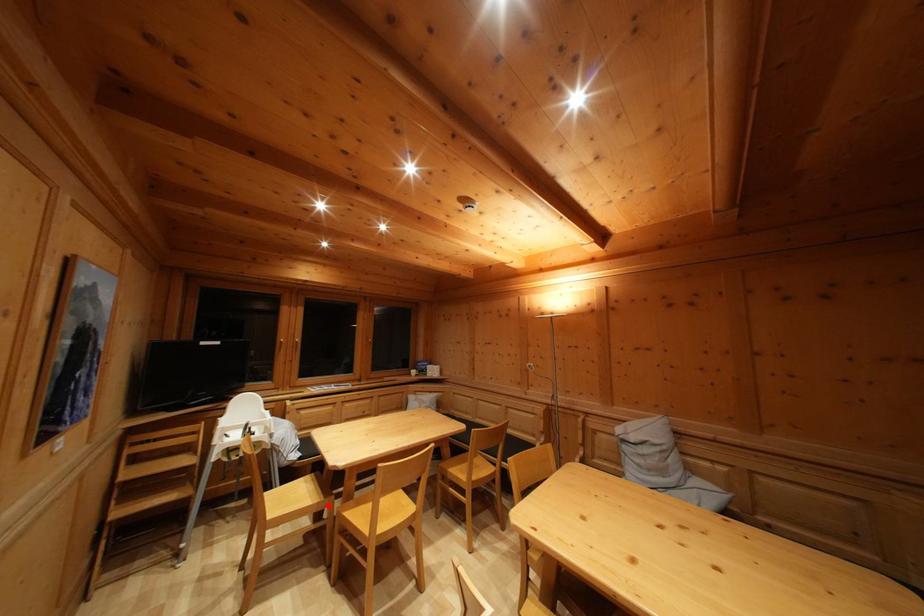
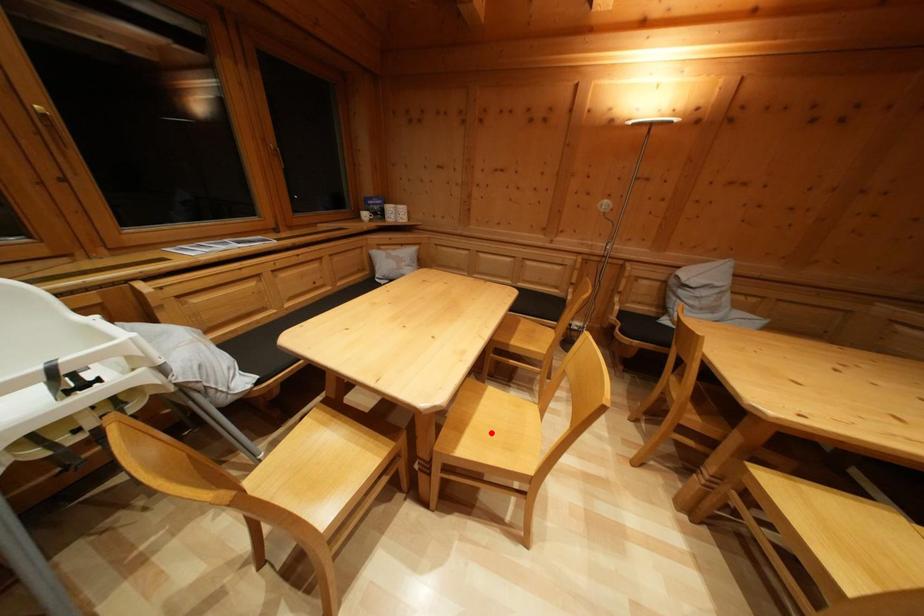
I am providing you with two images of the same scene from different viewpoints. A red point is marked on the first image and another point is marked on the second image. Is the red point in image1 aligned with the point shown in image2?

No